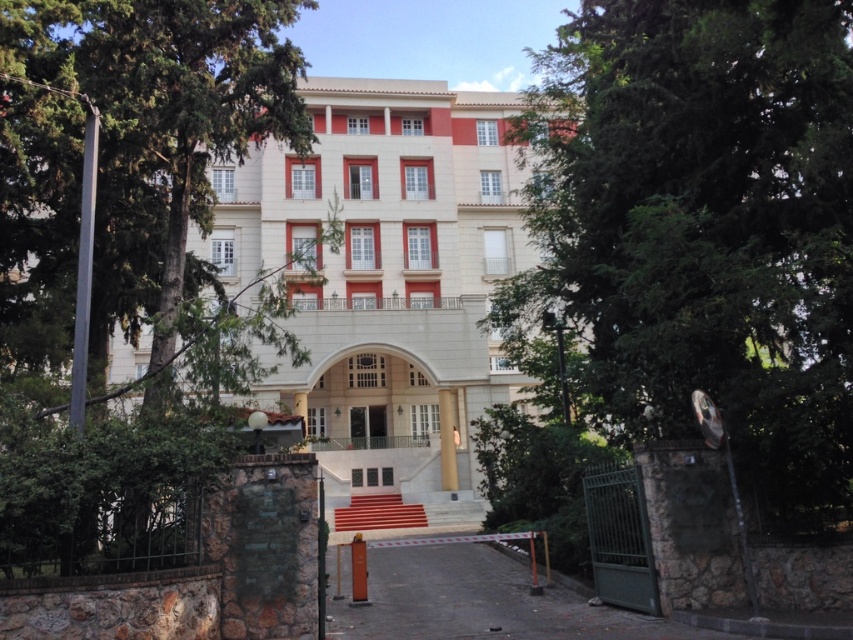
Is the position of green leafy tree at center less distant than that of beige stone building at center?

Yes, it is in front of beige stone building at center.

Image resolution: width=853 pixels, height=640 pixels. What do you see at coordinates (700, 230) in the screenshot?
I see `green leafy tree at center` at bounding box center [700, 230].

The image size is (853, 640). I want to click on green leafy tree at center, so click(x=700, y=230).

Based on the photo, is green leafy tree at left below beige stone building at center?

Yes, green leafy tree at left is below beige stone building at center.

Is point (45, 509) closer to camera compared to point (426, 365)?

Yes, point (45, 509) is in front of point (426, 365).

Image resolution: width=853 pixels, height=640 pixels. I want to click on green leafy tree at left, so click(x=131, y=262).

Can you confirm if green leafy tree at center is positioned to the right of green leafy tree at left?

Indeed, green leafy tree at center is positioned on the right side of green leafy tree at left.

Is point (679, 360) more distant than point (39, 148)?

No, it is in front of (39, 148).

Find the location of a particular element. Image resolution: width=853 pixels, height=640 pixels. green leafy tree at center is located at coordinates (700, 230).